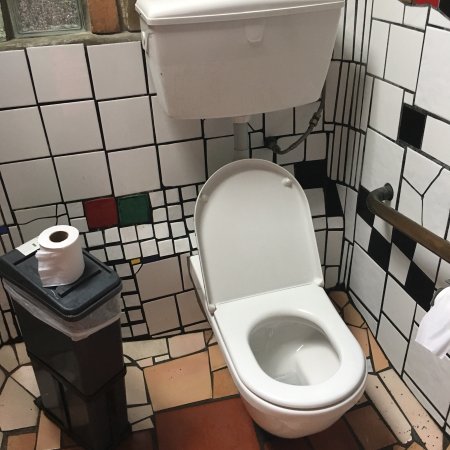
The width and height of the screenshot is (450, 450). Identify the location of tile to left of green wall tile. (107, 214).